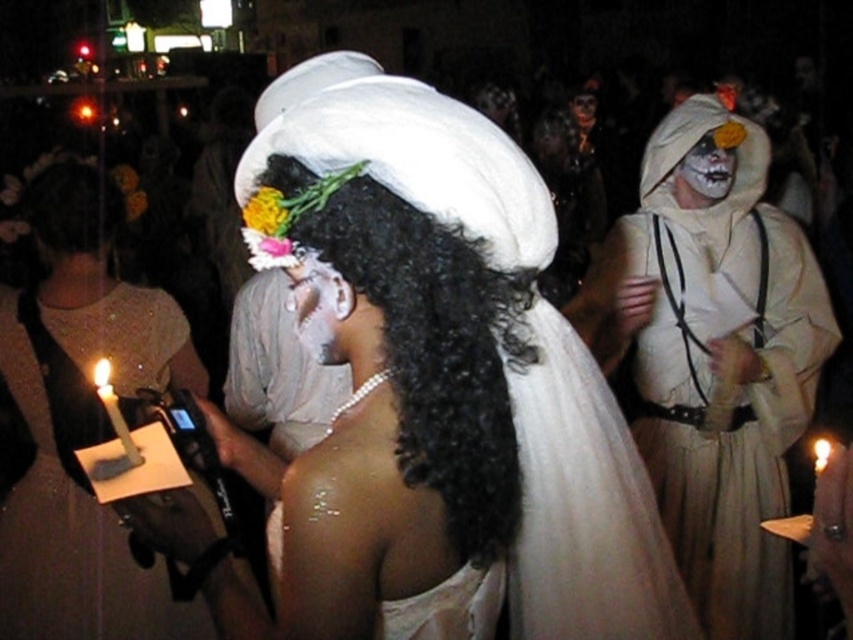
Question: Does matte white robe at right have a smaller size compared to white satin dress at lower left?

Choices:
 (A) yes
 (B) no

Answer: (B)

Question: Does pearl necklace at upper center have a greater width compared to white matte mask at upper right?

Choices:
 (A) no
 (B) yes

Answer: (A)

Question: Which object appears closest to the camera in this image?

Choices:
 (A) pearl necklace at upper center
 (B) smooth white mask at center
 (C) matte white robe at right

Answer: (A)

Question: Estimate the real-world distances between objects in this image. Which object is farther from the white matte mask at upper right?

Choices:
 (A) pearl necklace at upper center
 (B) white satin dress at lower left
 (C) matte white robe at right
 (D) smooth white mask at center

Answer: (D)

Question: Is matte white robe at right bigger than pearl necklace at upper center?

Choices:
 (A) yes
 (B) no

Answer: (A)

Question: Considering the real-world distances, which object is farthest from the white satin dress at lower left?

Choices:
 (A) smooth white mask at center
 (B) black curly hair at center

Answer: (A)